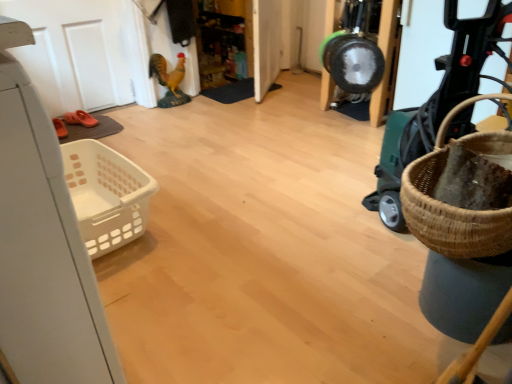
The image size is (512, 384). I want to click on free point in front of orange rubber sandal at left, so click(x=77, y=133).